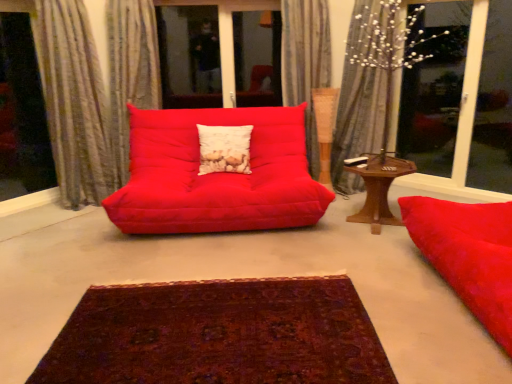
What do you see at coordinates (224, 149) in the screenshot? Image resolution: width=512 pixels, height=384 pixels. I see `white textured pillow at center` at bounding box center [224, 149].

Image resolution: width=512 pixels, height=384 pixels. Identify the location of deep burgundy woven rug at center. (218, 335).

At what (x,y) coordinates should I click in order to perform the action: click on wooden hexagonal table at right. Please return your answer as a coordinate pair (x, y). Looking at the image, I should click on (379, 189).

Is wooden hexagonal table at right wider or thinner than silky gray curtain at upper center, which ranks as the fourth curtain in left-to-right order?

In the image, wooden hexagonal table at right appears to be wider than silky gray curtain at upper center, which ranks as the fourth curtain in left-to-right order.

Can you confirm if wooden hexagonal table at right is shorter than silky gray curtain at upper center, the first curtain viewed from the right?

Correct, wooden hexagonal table at right is not as tall as silky gray curtain at upper center, the first curtain viewed from the right.

How different are the orientations of wooden hexagonal table at right and silky gray curtain at upper center, the first curtain viewed from the right, in degrees?

35.6 degrees.

Considering their positions, is wooden hexagonal table at right located in front of or behind silky gray curtain at upper center, which ranks as the fourth curtain in left-to-right order?

Clearly, wooden hexagonal table at right is in front of silky gray curtain at upper center, which ranks as the fourth curtain in left-to-right order.

Is wooden hexagonal table at right facing away from deep burgundy woven rug at center?

No.

The image size is (512, 384). In order to click on table located above the deep burgundy woven rug at center (from a real-world perspective) in this screenshot , I will do `click(379, 189)`.

Considering the sizes of objects wooden hexagonal table at right and deep burgundy woven rug at center in the image provided, who is taller, wooden hexagonal table at right or deep burgundy woven rug at center?

With more height is wooden hexagonal table at right.

Based on the photo, are textured beige curtain at left, the 3th curtain from the right, and white textured pillow at center far apart?

→ That's not correct — textured beige curtain at left, the 3th curtain from the right, is a little close to white textured pillow at center.

Which of these two, textured beige curtain at left, the 3th curtain from the right, or white textured pillow at center, is thinner?

Thinner between the two is white textured pillow at center.

Which object is closer to the camera, textured beige curtain at left, the second curtain from the left, or white textured pillow at center?

textured beige curtain at left, the second curtain from the left, is more forward.

Based on the photo, how many degrees apart are the facing directions of textured beige curtain at left, the second curtain from the left, and white textured pillow at center?

There is a 5.15-degree angle between the facing directions of textured beige curtain at left, the second curtain from the left, and white textured pillow at center.

Could you tell me if transparent glass window at upper right is facing transparent glass window screen at left?

No, transparent glass window at upper right is not facing towards transparent glass window screen at left.

Between transparent glass window at upper right and transparent glass window screen at left, which one has smaller width?

transparent glass window screen at left is thinner.

Which is in front, point (477, 162) or point (51, 169)?

Point (477, 162)

Between transparent glass window at upper right and textured beige curtain at left, the second curtain from the left, which one appears on the right side from the viewer's perspective?

transparent glass window at upper right is more to the right.

Could you tell me if transparent glass window at upper right is turned towards textured beige curtain at left, the second curtain from the left?

No.

Is textured beige curtain at left, the second curtain from the left, completely or partially inside transparent glass window at upper right?

That's incorrect, textured beige curtain at left, the second curtain from the left, is not inside transparent glass window at upper right.

Is matte red studio couch at right, the 1th studio couch viewed from the front, taller than textured beige curtain at left, the second curtain from the left?

No, matte red studio couch at right, the 1th studio couch viewed from the front, is not taller than textured beige curtain at left, the second curtain from the left.

Considering the points (457, 278) and (155, 25), which point is in front, point (457, 278) or point (155, 25)?

The point (457, 278) is more forward.

Is matte red studio couch at right, which is the second studio couch in left-to-right order, to the left of textured beige curtain at left, the second curtain from the left, from the viewer's perspective?

In fact, matte red studio couch at right, which is the second studio couch in left-to-right order, is to the right of textured beige curtain at left, the second curtain from the left.

Looking at this image, from the image's perspective, which is below, matte red studio couch at right, marked as the second studio couch in a back-to-front arrangement, or textured beige curtain at left, the second curtain from the left?

matte red studio couch at right, marked as the second studio couch in a back-to-front arrangement, is shown below in the image.

Considering the relative sizes of deep burgundy woven rug at center and textured grey curtain at left, placed as the 4th curtain when sorted from right to left, in the image provided, is deep burgundy woven rug at center bigger than textured grey curtain at left, placed as the 4th curtain when sorted from right to left,?

Actually, deep burgundy woven rug at center might be smaller than textured grey curtain at left, placed as the 4th curtain when sorted from right to left.

Can you tell me how much deep burgundy woven rug at center and textured grey curtain at left, which is counted as the first curtain, starting from the left, differ in facing direction?

There is a 39.9-degree angle between the facing directions of deep burgundy woven rug at center and textured grey curtain at left, which is counted as the first curtain, starting from the left.

Is deep burgundy woven rug at center positioned behind textured grey curtain at left, which is counted as the first curtain, starting from the left?

No.

Locate an element on the screen. This screenshot has width=512, height=384. curtain on the right side of wooden hexagonal table at right is located at coordinates point(357,109).

This screenshot has width=512, height=384. Find the location of `table located behind the deep burgundy woven rug at center`. table located behind the deep burgundy woven rug at center is located at coordinates (379, 189).

When comparing their distances from deep burgundy woven rug at center, does textured grey curtain at left, placed as the 4th curtain when sorted from right to left, or matte red studio couch at center, which is the second studio couch in right-to-left order, seem closer?

matte red studio couch at center, which is the second studio couch in right-to-left order.

Which object lies nearer to the anchor point textured beige curtain at upper center, the second curtain in the right-to-left sequence, transparent glass window at upper right or textured grey curtain at left, placed as the 4th curtain when sorted from right to left?

transparent glass window at upper right is closer to textured beige curtain at upper center, the second curtain in the right-to-left sequence.

Considering their positions, is textured beige curtain at left, the 3th curtain from the right, positioned further to wooden hexagonal table at right than matte red studio couch at center, the first studio couch from the left?

textured beige curtain at left, the 3th curtain from the right, is further to wooden hexagonal table at right.

Estimate the real-world distances between objects in this image. Which object is closer to silky gray curtain at upper center, the first curtain viewed from the right, textured beige curtain at upper center, arranged as the 3th curtain when viewed from the left, or transparent glass window screen at left?

The object closer to silky gray curtain at upper center, the first curtain viewed from the right, is textured beige curtain at upper center, arranged as the 3th curtain when viewed from the left.

From the image, which object appears to be farther from white textured pillow at center, deep burgundy woven rug at center or wooden hexagonal table at right?

deep burgundy woven rug at center lies further to white textured pillow at center than the other object.

From the image, which object appears to be nearer to silky gray curtain at upper center, which ranks as the fourth curtain in left-to-right order, wooden hexagonal table at right or transparent glass window at upper right?

The object closer to silky gray curtain at upper center, which ranks as the fourth curtain in left-to-right order, is wooden hexagonal table at right.

Which object lies further to the anchor point textured beige curtain at left, the 3th curtain from the right, matte red studio couch at center, acting as the 2th studio couch starting from the front, or wooden hexagonal table at right?

wooden hexagonal table at right.

Looking at this image, when comparing their distances from textured grey curtain at left, placed as the 4th curtain when sorted from right to left, does matte red studio couch at center, which is the second studio couch in right-to-left order, or wooden hexagonal table at right seem further?

wooden hexagonal table at right is positioned further to the anchor textured grey curtain at left, placed as the 4th curtain when sorted from right to left.

At what (x,y) coordinates should I click in order to perform the action: click on mat situated between transparent glass window screen at left and silky gray curtain at upper center, which ranks as the fourth curtain in left-to-right order, from left to right. Please return your answer as a coordinate pair (x, y). Looking at the image, I should click on (218, 335).

The image size is (512, 384). I want to click on pillow between textured beige curtain at left, the second curtain from the left, and matte red studio couch at right, the 1th studio couch viewed from the front, in the horizontal direction, so click(224, 149).

The image size is (512, 384). Find the location of `table between textured grey curtain at left, which is counted as the first curtain, starting from the left, and transparent glass window at upper right`. table between textured grey curtain at left, which is counted as the first curtain, starting from the left, and transparent glass window at upper right is located at coordinates (379, 189).

This screenshot has width=512, height=384. Find the location of `mat situated between white textured pillow at center and transparent glass window at upper right from left to right`. mat situated between white textured pillow at center and transparent glass window at upper right from left to right is located at coordinates (218, 335).